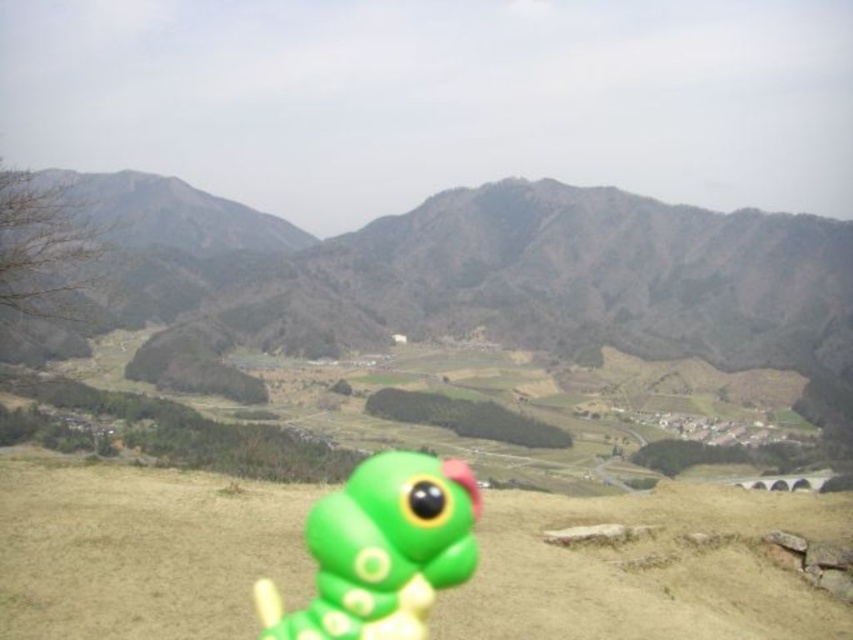
Between green matte toy at center and green matte toy at lower center, which one has more height?

With more height is green matte toy at lower center.

Who is positioned more to the left, green matte toy at center or green matte toy at lower center?

From the viewer's perspective, green matte toy at lower center appears more on the left side.

Identify the location of green matte toy at center. Image resolution: width=853 pixels, height=640 pixels. (142, 552).

This screenshot has width=853, height=640. In order to click on green matte toy at center in this screenshot , I will do `click(142, 552)`.